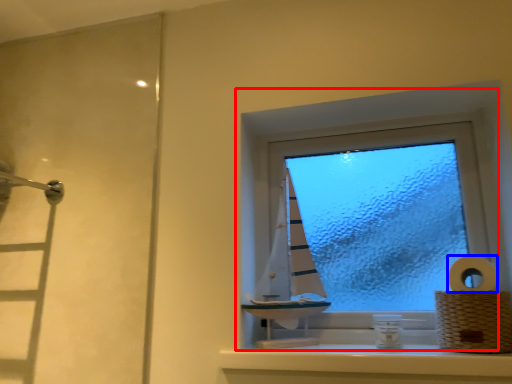
Question: Which object appears farthest to the camera in this image, window (highlighted by a red box) or toilet paper (highlighted by a blue box)?

Choices:
 (A) window
 (B) toilet paper

Answer: (A)